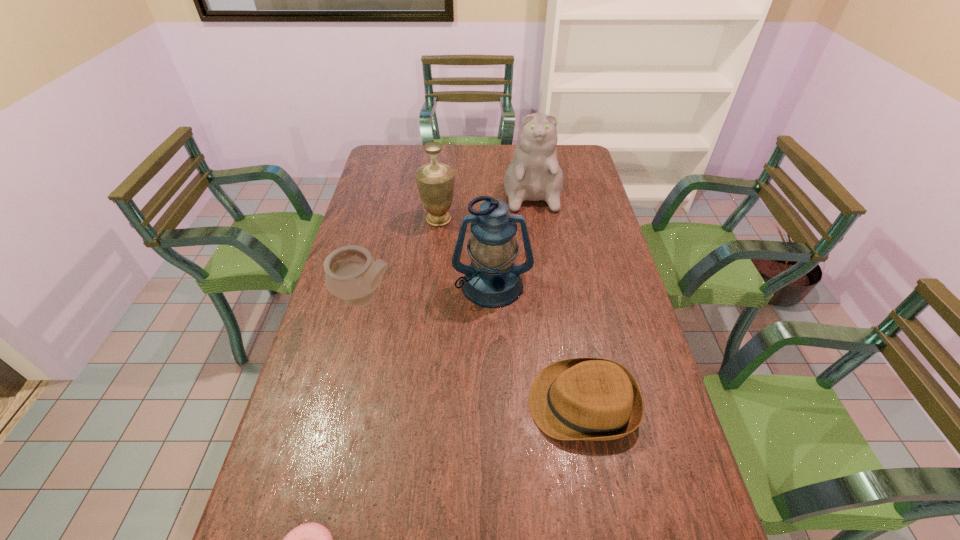
Image resolution: width=960 pixels, height=540 pixels. I want to click on cat, so click(x=534, y=174).

Find the location of `lantern`. lantern is located at coordinates (492, 280).

You are a GUI agent. You are given a task and a screenshot of the screen. Output one action in this format:
    pyautogui.click(x=<x>, y=<y>)
    Task: Click on the urn
    The height and width of the screenshot is (540, 960).
    Given the screenshot: What is the action you would take?
    point(435,181)

Find the location of a particular element. The height and width of the screenshot is (540, 960). pottery is located at coordinates (352, 274).

Locate an element on the screen. This screenshot has height=540, width=960. the fifth tallest object is located at coordinates (595, 399).

The width and height of the screenshot is (960, 540). What are the coordinates of `fedora` in the screenshot? It's located at (595, 399).

The height and width of the screenshot is (540, 960). I want to click on free spot located 0.370m on the face of the cat, so click(545, 285).

You are a GUI agent. You are given a task and a screenshot of the screen. Output one action in this format:
    pyautogui.click(x=<x>, y=<y>)
    Task: Click on the vacant space located on the face of the lantern
    
    Given the screenshot: What is the action you would take?
    pyautogui.click(x=493, y=321)

Locate an element on the screen. The height and width of the screenshot is (540, 960). free spot located 0.170m on the right of the urn is located at coordinates (503, 219).

In order to click on vacant area situated 0.320m on the right of the third shortest object in this screenshot , I will do `click(501, 298)`.